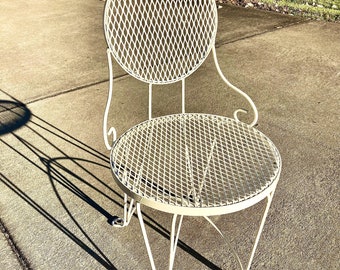
Identify the location of back chair leg seen through holes in the chair seat. Image resolution: width=340 pixels, height=270 pixels. (211, 153).